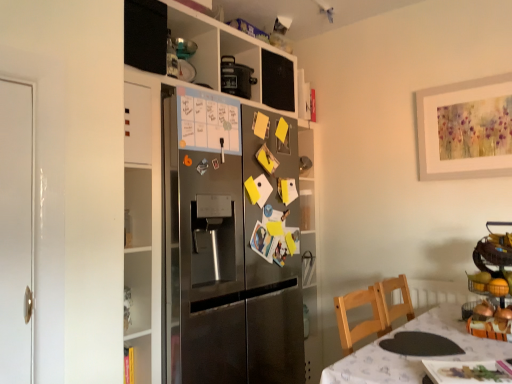
Question: Does metallic fruit basket at right appear on the left side of stainless steel refrigerator at center?

Choices:
 (A) no
 (B) yes

Answer: (A)

Question: Is metallic fruit basket at right next to stainless steel refrigerator at center and touching it?

Choices:
 (A) yes
 (B) no

Answer: (B)

Question: Is metallic fruit basket at right turned away from stainless steel refrigerator at center?

Choices:
 (A) yes
 (B) no

Answer: (B)

Question: Is metallic fruit basket at right behind stainless steel refrigerator at center?

Choices:
 (A) yes
 (B) no

Answer: (B)

Question: Could you tell me if metallic fruit basket at right is turned towards stainless steel refrigerator at center?

Choices:
 (A) no
 (B) yes

Answer: (A)

Question: Is stainless steel refrigerator at center taller or shorter than white fabric table at lower right?

Choices:
 (A) tall
 (B) short

Answer: (A)

Question: Considering their positions, is stainless steel refrigerator at center located in front of or behind white fabric table at lower right?

Choices:
 (A) front
 (B) behind

Answer: (B)

Question: Does point pyautogui.click(x=136, y=288) appear closer or farther from the camera than point pyautogui.click(x=398, y=377)?

Choices:
 (A) closer
 (B) farther

Answer: (B)

Question: Is stainless steel refrigerator at center spatially inside white fabric table at lower right, or outside of it?

Choices:
 (A) inside
 (B) outside

Answer: (B)

Question: Considering the positions of white fabric table at lower right and metallic fruit basket at right in the image, is white fabric table at lower right wider or thinner than metallic fruit basket at right?

Choices:
 (A) thin
 (B) wide

Answer: (B)

Question: From the image's perspective, relative to metallic fruit basket at right, is white fabric table at lower right above or below?

Choices:
 (A) below
 (B) above

Answer: (A)

Question: Relative to metallic fruit basket at right, is white fabric table at lower right in front or behind?

Choices:
 (A) front
 (B) behind

Answer: (A)

Question: Is white fabric table at lower right situated inside metallic fruit basket at right or outside?

Choices:
 (A) outside
 (B) inside

Answer: (A)

Question: Considering the positions of stainless steel refrigerator at center and metallic fruit basket at right in the image, is stainless steel refrigerator at center taller or shorter than metallic fruit basket at right?

Choices:
 (A) short
 (B) tall

Answer: (B)

Question: Is stainless steel refrigerator at center wider or thinner than metallic fruit basket at right?

Choices:
 (A) wide
 (B) thin

Answer: (A)